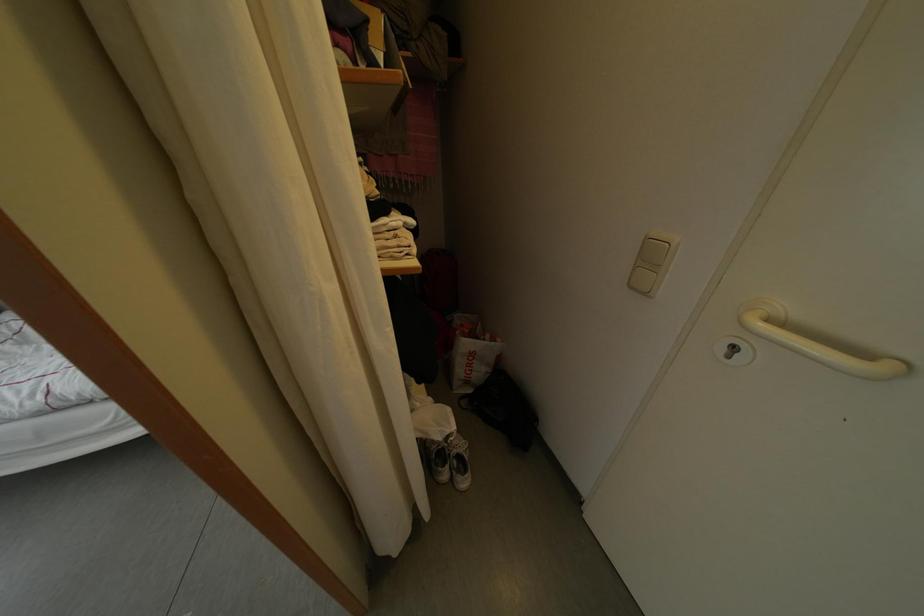
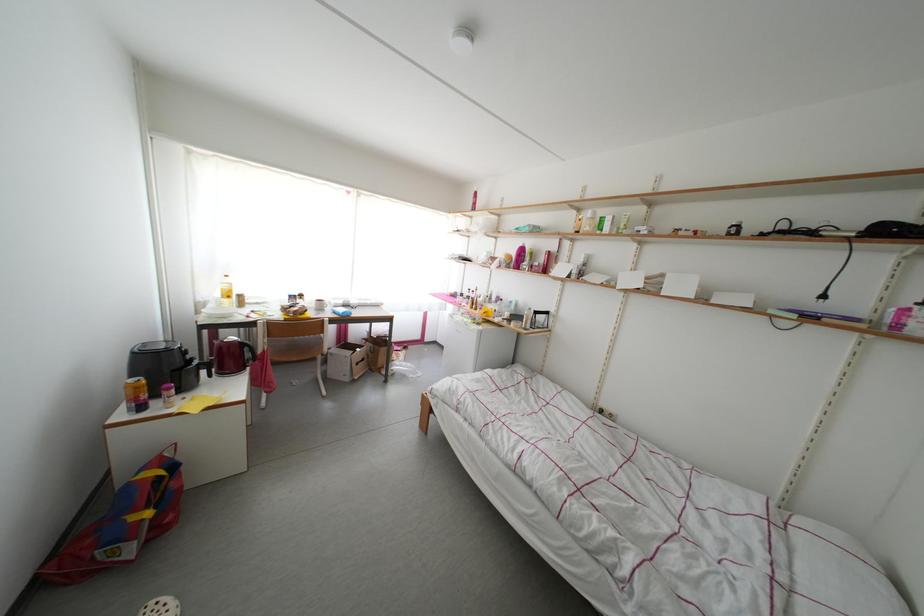
Question: The first image is from the beginning of the video and the second image is from the end. How did the camera likely rotate when shooting the video?

Choices:
 (A) Left
 (B) Right
 (C) Up
 (D) Down

Answer: (A)